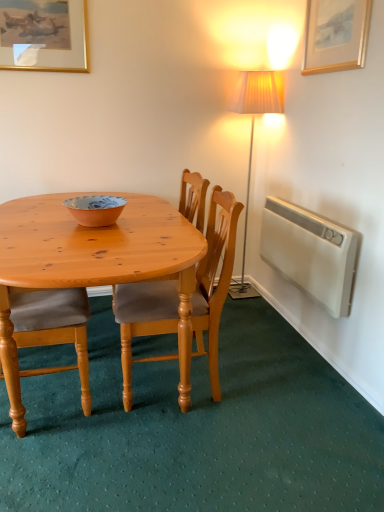
The width and height of the screenshot is (384, 512). What are the coordinates of `unoccupied area in front of wooden chair at left, the 1th chair positioned from the left` in the screenshot? It's located at (56, 460).